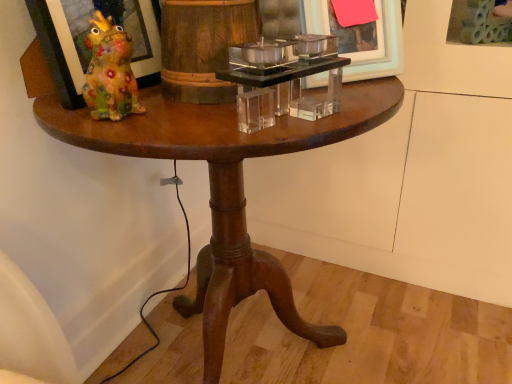
Question: Does matte glass picture frame at left, which is the first picture frame in left-to-right order, have a lesser height compared to clear acrylic candle holder at center?

Choices:
 (A) no
 (B) yes

Answer: (A)

Question: Could you tell me if matte glass picture frame at left, which appears as the third picture frame when viewed from the right, is facing clear acrylic candle holder at center?

Choices:
 (A) yes
 (B) no

Answer: (A)

Question: Is clear acrylic candle holder at center located within matte glass picture frame at left, which is the first picture frame in left-to-right order?

Choices:
 (A) no
 (B) yes

Answer: (A)

Question: Can you confirm if matte glass picture frame at left, which is the first picture frame in left-to-right order, is smaller than clear acrylic candle holder at center?

Choices:
 (A) yes
 (B) no

Answer: (B)

Question: Considering the relative sizes of matte glass picture frame at left, which is the first picture frame in left-to-right order, and clear acrylic candle holder at center in the image provided, is matte glass picture frame at left, which is the first picture frame in left-to-right order, thinner than clear acrylic candle holder at center?

Choices:
 (A) no
 (B) yes

Answer: (B)

Question: Is matte glass picture frame at left, which is the first picture frame in left-to-right order, outside clear acrylic candle holder at center?

Choices:
 (A) no
 (B) yes

Answer: (B)

Question: From the image's perspective, is clear acrylic picture frame at upper right, which ranks as the third picture frame in left-to-right order, on clear acrylic candle holder at center?

Choices:
 (A) yes
 (B) no

Answer: (A)

Question: Is clear acrylic candle holder at center inside clear acrylic picture frame at upper right, the first picture frame when ordered from right to left?

Choices:
 (A) no
 (B) yes

Answer: (A)

Question: Considering the relative sizes of clear acrylic picture frame at upper right, which ranks as the third picture frame in left-to-right order, and clear acrylic candle holder at center in the image provided, is clear acrylic picture frame at upper right, which ranks as the third picture frame in left-to-right order, thinner than clear acrylic candle holder at center?

Choices:
 (A) no
 (B) yes

Answer: (B)

Question: Considering the relative positions of clear acrylic picture frame at upper right, which ranks as the third picture frame in left-to-right order, and clear acrylic candle holder at center in the image provided, is clear acrylic picture frame at upper right, which ranks as the third picture frame in left-to-right order, to the left of clear acrylic candle holder at center from the viewer's perspective?

Choices:
 (A) no
 (B) yes

Answer: (A)

Question: Is clear acrylic picture frame at upper right, the first picture frame when ordered from right to left, aimed at clear acrylic candle holder at center?

Choices:
 (A) yes
 (B) no

Answer: (B)

Question: Is clear acrylic picture frame at upper right, which ranks as the third picture frame in left-to-right order, positioned with its back to clear acrylic candle holder at center?

Choices:
 (A) no
 (B) yes

Answer: (A)

Question: From the image's perspective, does matte glass picture frame at left, which appears as the third picture frame when viewed from the right, appear lower than clear acrylic picture frame at upper right, which ranks as the third picture frame in left-to-right order?

Choices:
 (A) no
 (B) yes

Answer: (B)